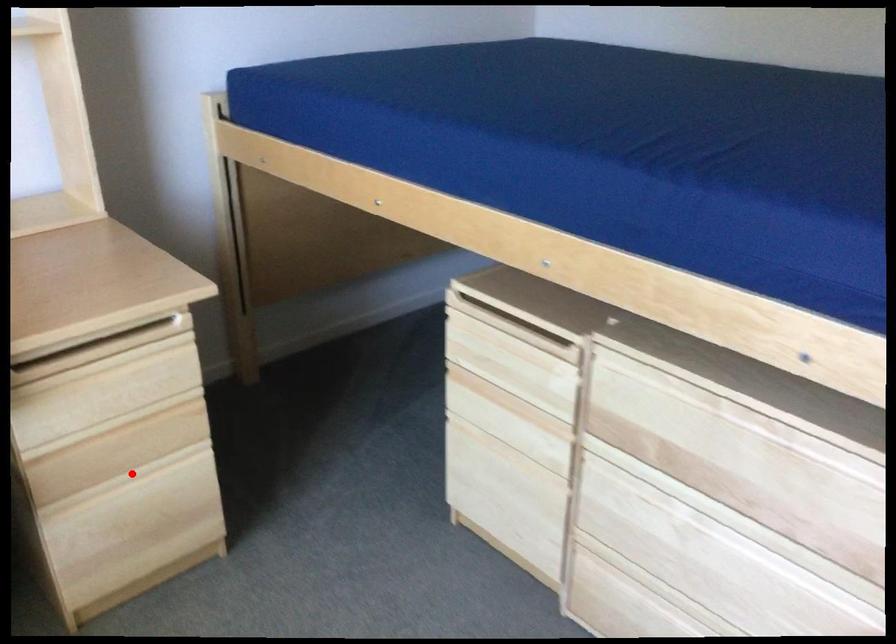
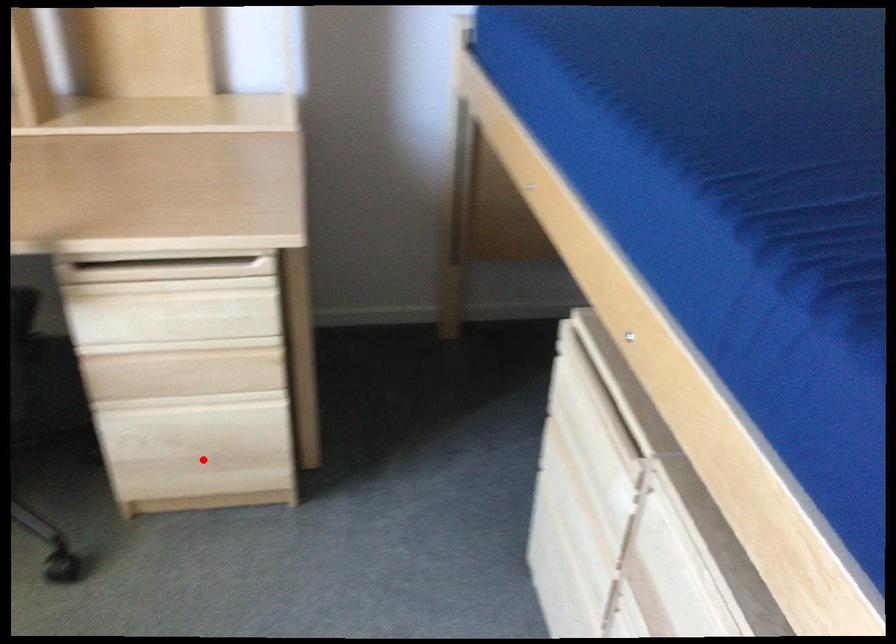
I am providing you with two images of the same scene from different viewpoints. A red point is marked on the first image and another point is marked on the second image. Is the marked point in image1 the same physical position as the marked point in image2?

No